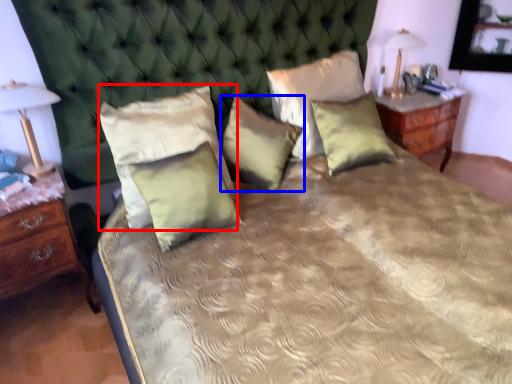
Question: Among these objects, which one is nearest to the camera, pillow (highlighted by a red box) or pillow (highlighted by a blue box)?

Choices:
 (A) pillow
 (B) pillow

Answer: (A)